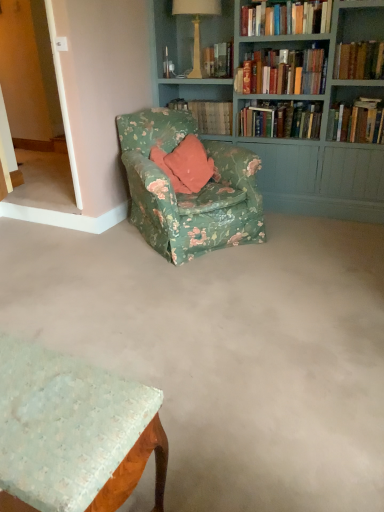
Question: Can you confirm if teal painted wood bookcase at upper right is bigger than matte cream lamp at upper center?

Choices:
 (A) no
 (B) yes

Answer: (B)

Question: Are teal painted wood bookcase at upper right and matte cream lamp at upper center beside each other?

Choices:
 (A) no
 (B) yes

Answer: (A)

Question: Is teal painted wood bookcase at upper right thinner than matte cream lamp at upper center?

Choices:
 (A) no
 (B) yes

Answer: (A)

Question: Can we say teal painted wood bookcase at upper right lies outside matte cream lamp at upper center?

Choices:
 (A) yes
 (B) no

Answer: (A)

Question: Is teal painted wood bookcase at upper right positioned behind matte cream lamp at upper center?

Choices:
 (A) yes
 (B) no

Answer: (B)

Question: Based on their sizes in the image, would you say hardcover books at upper center, positioned as the fifth book in right-to-left order, is bigger or smaller than hardcover books at upper right, which is counted as the third book, starting from the right?

Choices:
 (A) big
 (B) small

Answer: (B)

Question: Is point (312, 65) positioned closer to the camera than point (249, 110)?

Choices:
 (A) farther
 (B) closer

Answer: (B)

Question: Relative to hardcover books at upper right, arranged as the fourth book when viewed from the left, is hardcover books at upper center, positioned as the fifth book in right-to-left order, in front or behind?

Choices:
 (A) behind
 (B) front

Answer: (B)

Question: Is hardcover books at upper center, positioned as the fifth book in right-to-left order, taller or shorter than hardcover books at upper right, arranged as the fourth book when viewed from the left?

Choices:
 (A) short
 (B) tall

Answer: (B)

Question: From a real-world perspective, is floral fabric book at center, which is the first book in left-to-right order, above or below hardcover books at upper right, which is the first book from right to left?

Choices:
 (A) below
 (B) above

Answer: (A)

Question: From their relative heights in the image, would you say floral fabric book at center, which is the first book in left-to-right order, is taller or shorter than hardcover books at upper right, which is the first book from right to left?

Choices:
 (A) tall
 (B) short

Answer: (B)

Question: Choose the correct answer: Is floral fabric book at center, which is the first book in left-to-right order, inside hardcover books at upper right, which is the first book from right to left, or outside it?

Choices:
 (A) inside
 (B) outside

Answer: (B)

Question: In terms of size, does floral fabric book at center, which is the sixth book from right to left, appear bigger or smaller than hardcover books at upper right, which is the first book from right to left?

Choices:
 (A) small
 (B) big

Answer: (B)

Question: Considering their positions, is hardcover books at upper right, arranged as the fourth book when viewed from the left, located in front of or behind floral fabric table at lower left?

Choices:
 (A) behind
 (B) front

Answer: (A)

Question: From the image's perspective, is hardcover books at upper right, arranged as the fourth book when viewed from the left, positioned above or below floral fabric table at lower left?

Choices:
 (A) above
 (B) below

Answer: (A)